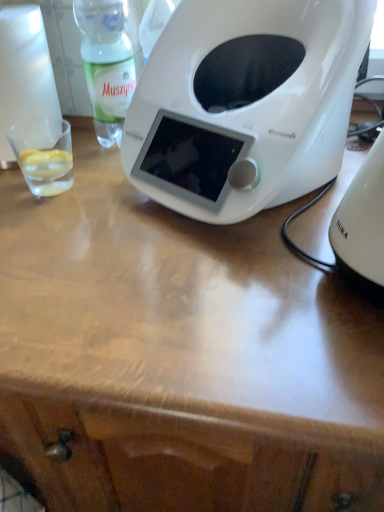
The width and height of the screenshot is (384, 512). I want to click on vacant point to the left of white plastic kettle at right, so click(259, 310).